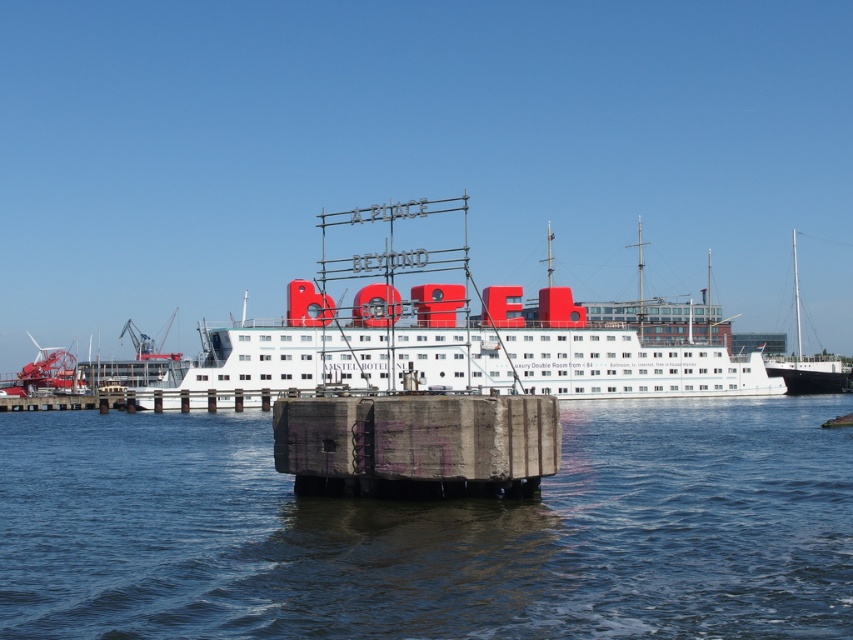
You are a tour guide explaining the waterfront scene to visitors. Pointing to the white matte boat at center and the concrete dock at center, you want to clarify their arrangement. Which one is located to the right of the other?

The white matte boat at center is positioned on the right side of concrete dock at center.

You are a photographer planning to capture the cruise ship and its surroundings. You want to ensure the transparent water at center and the concrete dock at center are both visible in your shot. Based on their positions, which object should you place on the left side of your frame to include both?

The transparent water at center is positioned on the left side of concrete dock at center, so to include both in the frame, you should place the transparent water at center on the left side of your frame and the concrete dock at center on the right side.

You are standing on the dock and looking at the cruise ship. There are two points marked on the ship, one at coordinate point (370, 384) and another at point (311, 440). Which point is closer to you?

Point (370, 384) is further to the viewer than point (311, 440), so the point closer to you is point (311, 440).